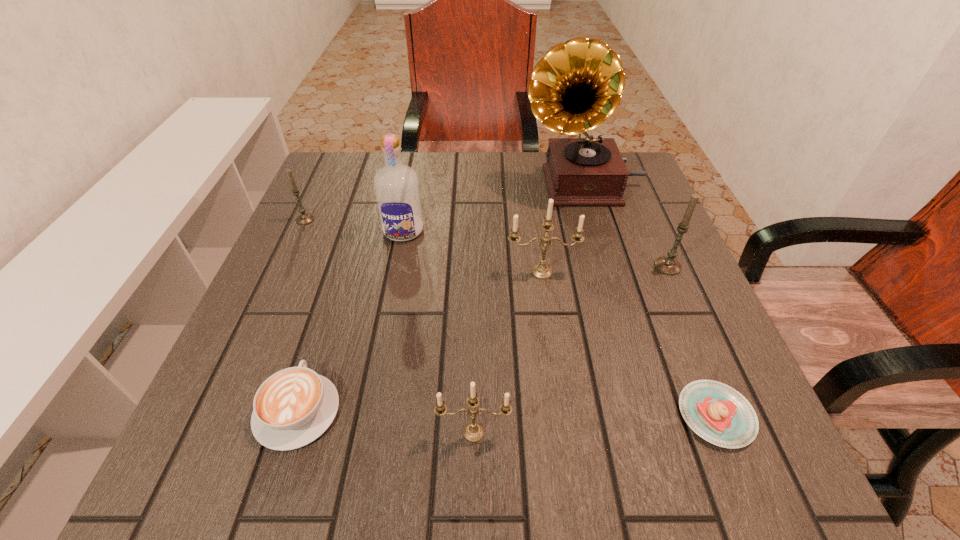
Locate an element on the screen. This screenshot has height=540, width=960. pastry at the near edge is located at coordinates (716, 412).

In order to click on candle situated at the left edge in this screenshot , I will do `click(305, 218)`.

The image size is (960, 540). In order to click on cappuccino that is at the left edge in this screenshot , I will do `click(293, 407)`.

You are a GUI agent. You are given a task and a screenshot of the screen. Output one action in this format:
    pyautogui.click(x=<x>, y=<y>)
    Task: Click on the phonograph record situated at the right edge
    This screenshot has height=540, width=960.
    Given the screenshot: What is the action you would take?
    pyautogui.click(x=577, y=85)

The width and height of the screenshot is (960, 540). Find the location of `candle at the right edge`. candle at the right edge is located at coordinates (668, 265).

Identify the location of pastry present at the right edge. The width and height of the screenshot is (960, 540). (716, 412).

This screenshot has height=540, width=960. I want to click on object present at the near left corner, so click(x=293, y=407).

Find the location of `object located at the far right corner`. object located at the far right corner is located at coordinates click(577, 85).

The width and height of the screenshot is (960, 540). I want to click on object located in the near right corner section of the desktop, so click(716, 412).

At what (x,y) coordinates should I click in order to perform the action: click on free point at the far edge. Please return your answer as a coordinate pair (x, y). The image size is (960, 540). Looking at the image, I should click on (450, 176).